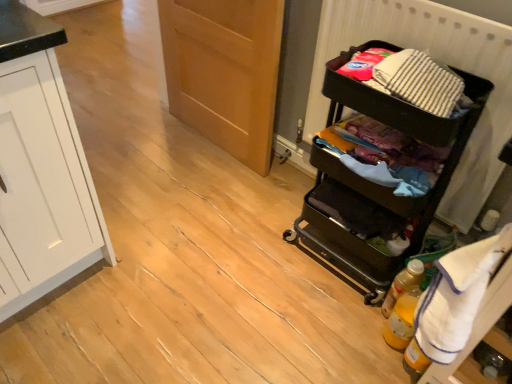
At what (x,y) coordinates should I click in order to perform the action: click on vacant point to the left of translucent yellow bottle at lower right, placed as the first bottle when sorted from front to back. Please return your answer as a coordinate pair (x, y). This screenshot has height=384, width=512. Looking at the image, I should click on (340, 337).